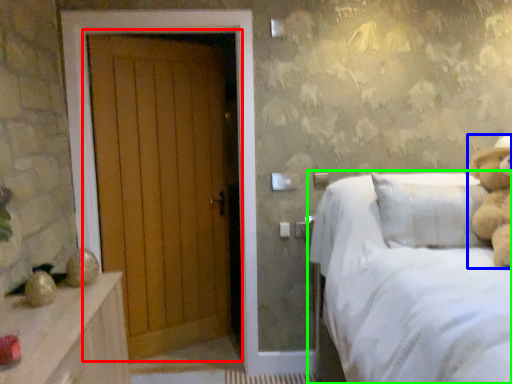
Question: Estimate the real-world distances between objects in this image. Which object is closer to door (highlighted by a red box), teddy bear (highlighted by a blue box) or bed (highlighted by a green box)?

Choices:
 (A) teddy bear
 (B) bed

Answer: (B)